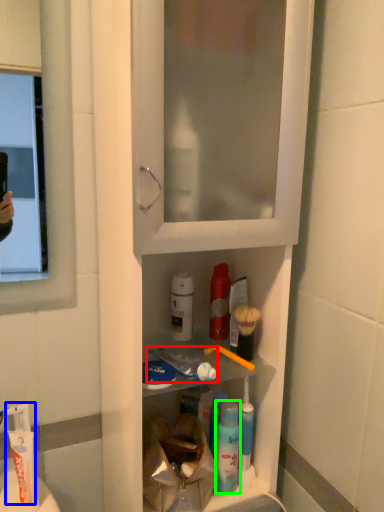
Question: Considering the real-world distances, which object is closest to toothpaste (highlighted by a red box)? toothpaste (highlighted by a blue box) or mouthwash (highlighted by a green box).

Choices:
 (A) toothpaste
 (B) mouthwash

Answer: (B)